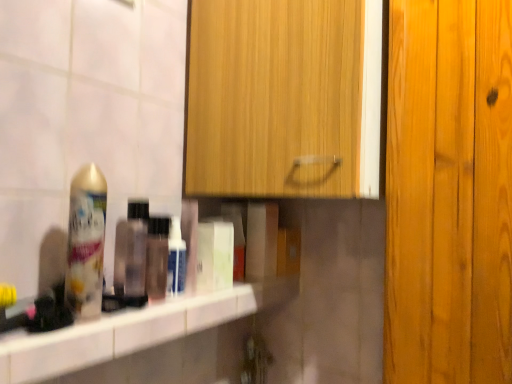
I want to click on free space above white glossy counter top at center (from a real-world perspective), so tap(168, 296).